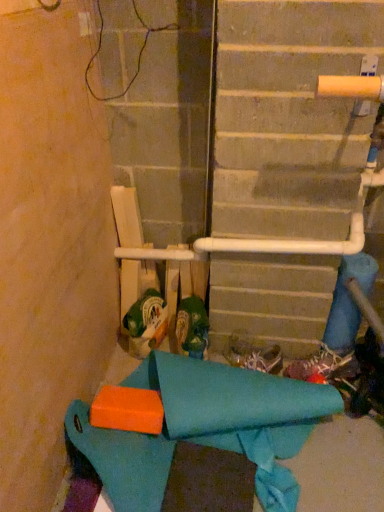
Question: From a real-world perspective, is white fabric shoe at center, the 2th footwear from the left, on top of green fabric shoe at center, marked as the 1th footwear in a left-to-right arrangement?

Choices:
 (A) no
 (B) yes

Answer: (A)

Question: From the image's perspective, is white fabric shoe at center, which is counted as the 2th footwear, starting from the right, on green fabric shoe at center, placed as the third footwear when sorted from right to left?

Choices:
 (A) yes
 (B) no

Answer: (B)

Question: From a real-world perspective, is white fabric shoe at center, which is counted as the 2th footwear, starting from the right, located beneath green fabric shoe at center, marked as the 1th footwear in a left-to-right arrangement?

Choices:
 (A) no
 (B) yes

Answer: (B)

Question: Would you say white fabric shoe at center, the 2th footwear from the left, is a long distance from green fabric shoe at center, marked as the 1th footwear in a left-to-right arrangement?

Choices:
 (A) no
 (B) yes

Answer: (A)

Question: Considering the relative sizes of white fabric shoe at center, which is counted as the 2th footwear, starting from the right, and green fabric shoe at center, placed as the third footwear when sorted from right to left, in the image provided, is white fabric shoe at center, which is counted as the 2th footwear, starting from the right, shorter than green fabric shoe at center, placed as the third footwear when sorted from right to left,?

Choices:
 (A) yes
 (B) no

Answer: (A)

Question: Is green fabric shoe at center, marked as the 1th footwear in a left-to-right arrangement, bigger or smaller than white fabric shoe at center, which is counted as the 2th footwear, starting from the right?

Choices:
 (A) big
 (B) small

Answer: (A)

Question: From a real-world perspective, is green fabric shoe at center, placed as the third footwear when sorted from right to left, above or below white fabric shoe at center, which is counted as the 2th footwear, starting from the right?

Choices:
 (A) below
 (B) above

Answer: (B)

Question: Based on their positions, is green fabric shoe at center, marked as the 1th footwear in a left-to-right arrangement, located to the left or right of white fabric shoe at center, which is counted as the 2th footwear, starting from the right?

Choices:
 (A) left
 (B) right

Answer: (A)

Question: From their relative heights in the image, would you say green fabric shoe at center, marked as the 1th footwear in a left-to-right arrangement, is taller or shorter than white fabric shoe at center, which is counted as the 2th footwear, starting from the right?

Choices:
 (A) tall
 (B) short

Answer: (A)

Question: From the image's perspective, relative to white textured shoe at lower right, the third footwear viewed from the left, is white fabric shoe at center, the 2th footwear from the left, above or below?

Choices:
 (A) above
 (B) below

Answer: (A)

Question: Would you say white fabric shoe at center, the 2th footwear from the left, is inside or outside white textured shoe at lower right, the 1th footwear when ordered from right to left?

Choices:
 (A) inside
 (B) outside

Answer: (B)

Question: Considering the positions of white fabric shoe at center, which is counted as the 2th footwear, starting from the right, and white textured shoe at lower right, the 1th footwear when ordered from right to left, in the image, is white fabric shoe at center, which is counted as the 2th footwear, starting from the right, wider or thinner than white textured shoe at lower right, the 1th footwear when ordered from right to left,?

Choices:
 (A) thin
 (B) wide

Answer: (B)

Question: From a real-world perspective, is white fabric shoe at center, the 2th footwear from the left, physically located above or below white textured shoe at lower right, the third footwear viewed from the left?

Choices:
 (A) above
 (B) below

Answer: (A)

Question: Is teal fabric at lower left taller or shorter than green fabric shoe at center, placed as the third footwear when sorted from right to left?

Choices:
 (A) short
 (B) tall

Answer: (A)

Question: From a real-world perspective, is teal fabric at lower left positioned above or below green fabric shoe at center, marked as the 1th footwear in a left-to-right arrangement?

Choices:
 (A) above
 (B) below

Answer: (B)